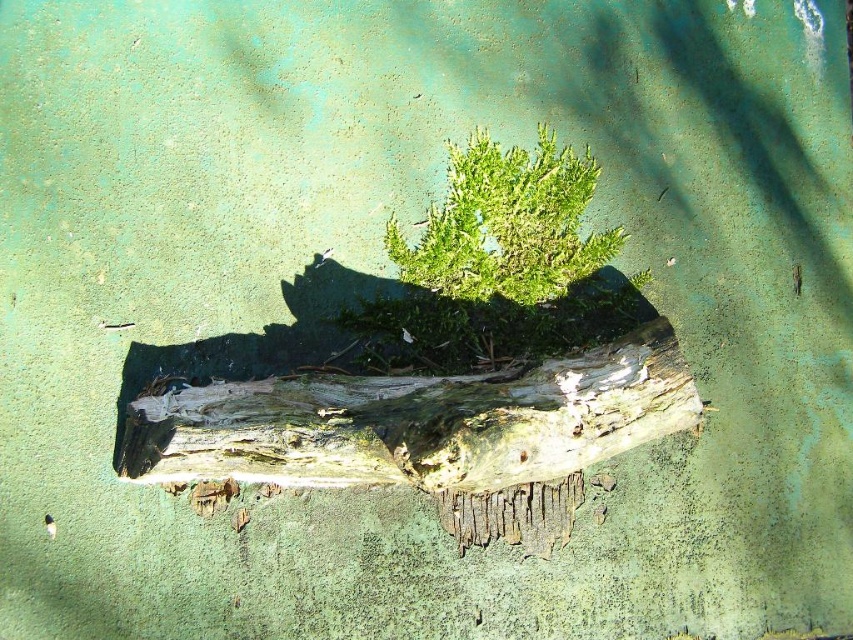
You are a gardener trying to transplant the green fuzzy fern at center. The space you have available is exactly the same width as the weathered wood log at center. Will the fern fit in the space?

The weathered wood log at center is wider than the green fuzzy fern at center. Since the available space matches the log width, the fern will fit as it is narrower.

Looking at this image, you are a gardener trying to plant a new fern in your garden. You have a weathered wood log at center and a green fuzzy fern at center. Which object should you use as a base for the fern to ensure it has enough space to grow?

The weathered wood log at center has a larger size compared to the green fuzzy fern at center, so it would provide enough space for the fern to grow.

You are standing 6 feet away from the camera. Can you see the point at coordinates point (496, 406)?

The point at coordinates point (496, 406) is 10.51 feet away from the camera. Since you are only 6 feet away from the camera, you are closer to the camera than the point, so you can see the point at coordinates point (496, 406).